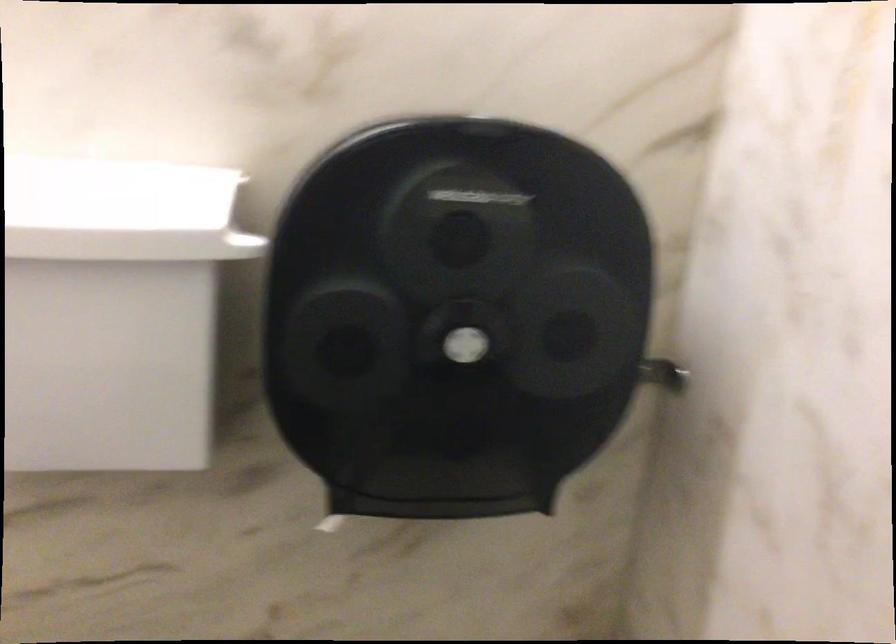
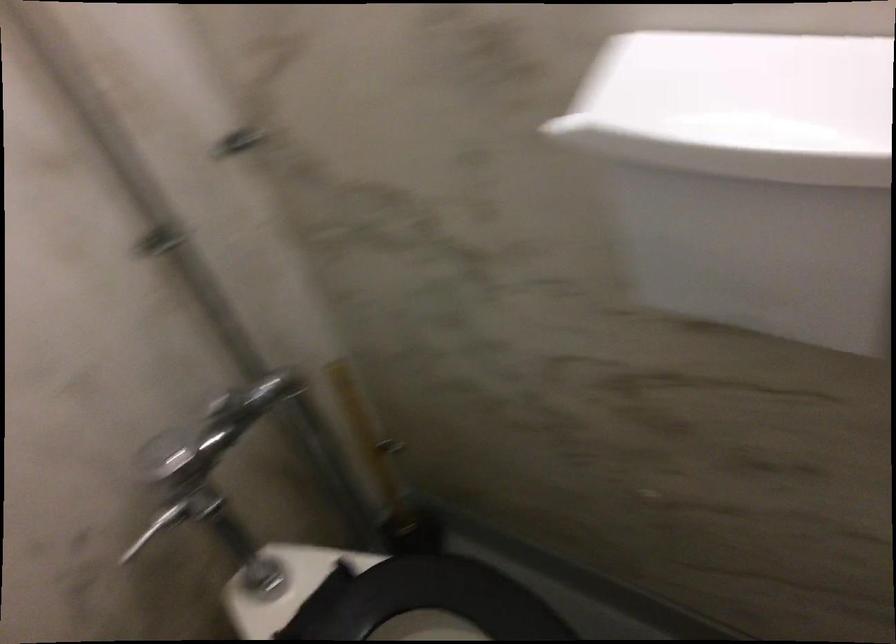
Based on the continuous images, in which direction is the camera rotating?

The rotation direction of the camera is left-down.